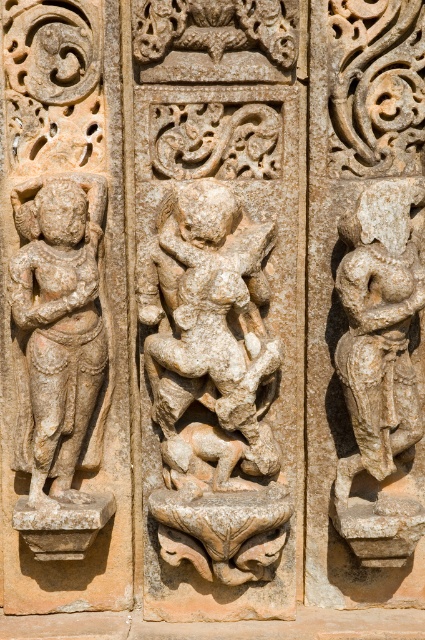
From the picture: Can you confirm if stone carved figure at center is positioned above stone statue at center?

Incorrect, stone carved figure at center is not positioned above stone statue at center.

Can you confirm if stone carved figure at center is positioned to the left of stone statue at center?

Correct, you'll find stone carved figure at center to the left of stone statue at center.

Which is in front, point (190, 368) or point (377, 518)?

Point (190, 368) is more forward.

The height and width of the screenshot is (640, 425). Identify the location of stone carved figure at center. (212, 385).

The image size is (425, 640). Describe the element at coordinates (379, 369) in the screenshot. I see `stone statue at center` at that location.

Is stone statue at center taller than stone carved figure at left?

Yes, stone statue at center is taller than stone carved figure at left.

Locate an element on the screen. This screenshot has height=640, width=425. stone statue at center is located at coordinates (379, 369).

Who is shorter, stone carved figure at center or stone carved figure at left?

Standing shorter between the two is stone carved figure at left.

Can you confirm if stone carved figure at center is wider than stone carved figure at left?

Yes.

You are a GUI agent. You are given a task and a screenshot of the screen. Output one action in this format:
    pyautogui.click(x=<x>, y=<y>)
    Task: Click on the stone carved figure at center
    
    Given the screenshot: What is the action you would take?
    pyautogui.click(x=212, y=385)

Identify the location of stone carved figure at center. (212, 385).